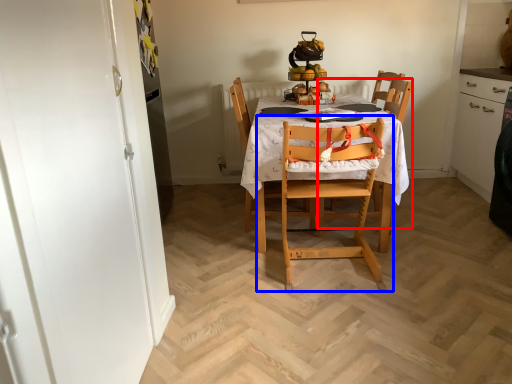
Question: Which object appears closest to the camera in this image, chair (highlighted by a red box) or chair (highlighted by a blue box)?

Choices:
 (A) chair
 (B) chair

Answer: (B)